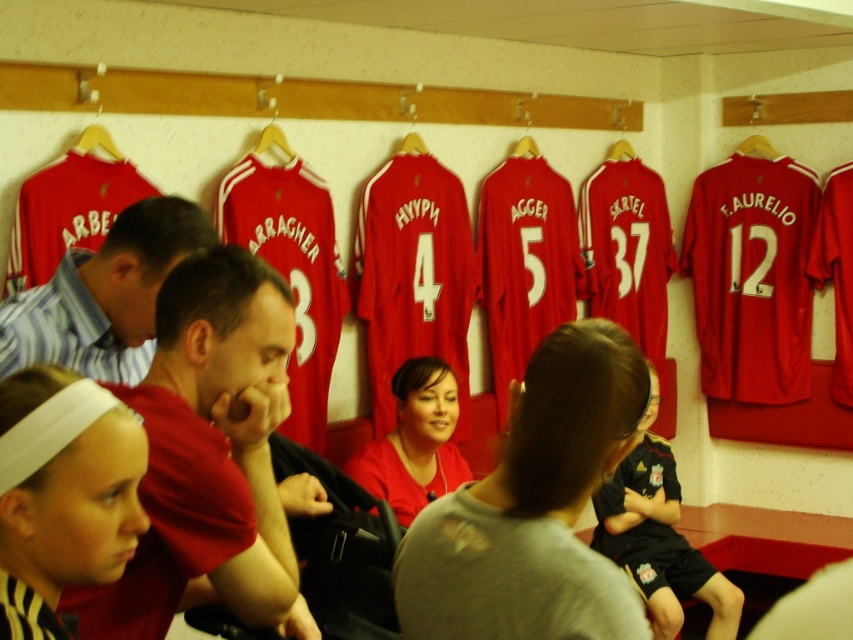
Question: Among these points, which one is nearest to the camera?

Choices:
 (A) (152, 388)
 (B) (62, 304)

Answer: (A)

Question: Which object is positioned farthest from the matte blue shirt at center?

Choices:
 (A) gray cotton t-shirt at center
 (B) matte red shirt at left
 (C) black jersey at center

Answer: (C)

Question: Is matte red shirt at left bigger than black jersey at center?

Choices:
 (A) no
 (B) yes

Answer: (A)

Question: Is matte red shirt at left bigger than gray cotton t-shirt at center?

Choices:
 (A) no
 (B) yes

Answer: (B)

Question: Is matte red shirt at left further to camera compared to matte blue shirt at center?

Choices:
 (A) no
 (B) yes

Answer: (A)

Question: Among these points, which one is nearest to the camera?

Choices:
 (A) (253, 440)
 (B) (544, 593)
 (C) (36, 333)
 (D) (695, 554)

Answer: (B)